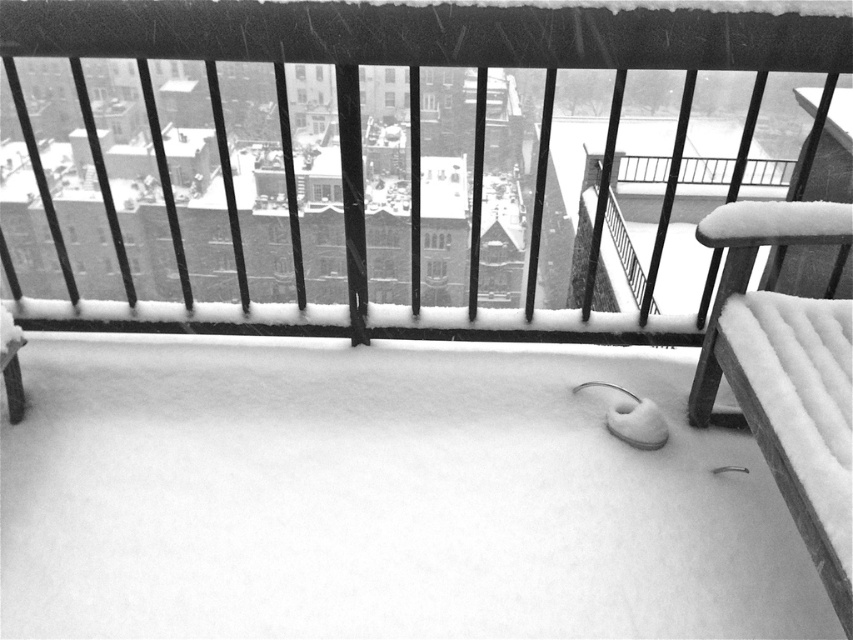
Which is more to the left, snow-covered bench at lower right or wooden park bench at right?

From the viewer's perspective, snow-covered bench at lower right appears more on the left side.

Who is taller, snow-covered bench at lower right or wooden park bench at right?

wooden park bench at right

From the picture: Who is more forward, (642,28) or (746,410)?

Point (746,410) is more forward.

At what (x,y) coordinates should I click in order to perform the action: click on snow-covered bench at lower right. Please return your answer as a coordinate pair (x, y). The height and width of the screenshot is (640, 853). Looking at the image, I should click on (413, 156).

Which of these two, wooden park bench at right or wooden park bench at left, stands taller?

wooden park bench at right

Can you confirm if wooden park bench at right is shorter than wooden park bench at left?

Answer: No.

Where is `wooden park bench at right`? This screenshot has width=853, height=640. wooden park bench at right is located at coordinates (787, 376).

Between point (809, 45) and point (4, 353), which one is positioned behind?

Point (4, 353)

Describe the element at coordinates (413, 156) in the screenshot. Image resolution: width=853 pixels, height=640 pixels. I see `snow-covered bench at lower right` at that location.

This screenshot has width=853, height=640. I want to click on snow-covered bench at lower right, so click(413, 156).